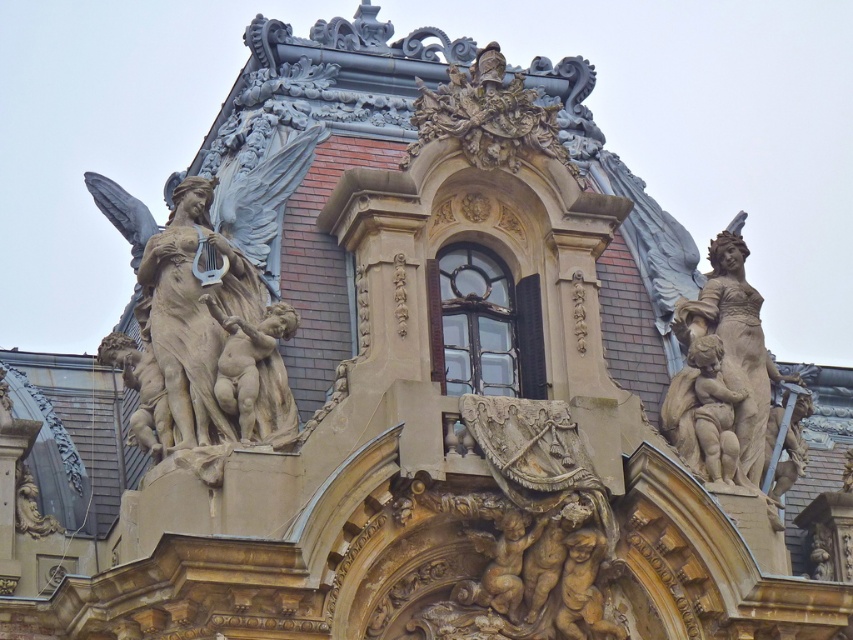
You are an art conservator assessing the statues on the building facade. The polished bronze statue at upper left and the carved stone statue at right need maintenance. Given their sizes, which statue requires more material for restoration? Please refer to their sizes as described.

The polished bronze statue at upper left requires more material for restoration because it is larger in size than the carved stone statue at right.

You are an architect analyzing the symmetry of the building facade. You observe the polished bronze statue at upper left. Where exactly is this statue positioned in terms of coordinates?

The polished bronze statue at upper left is positioned at coordinates (x=210, y=333).

You are an architect examining the building facade. You need to determine if the polished bronze statue at upper left can fit through a doorway that is currently the same width as the carved stone statue at right. Based on the spatial details provided, can the statue pass through the doorway?

The polished bronze statue at upper left might be wider than carved stone statue at right, so it may not fit through the doorway if the doorway is the same width as the carved stone statue at right.